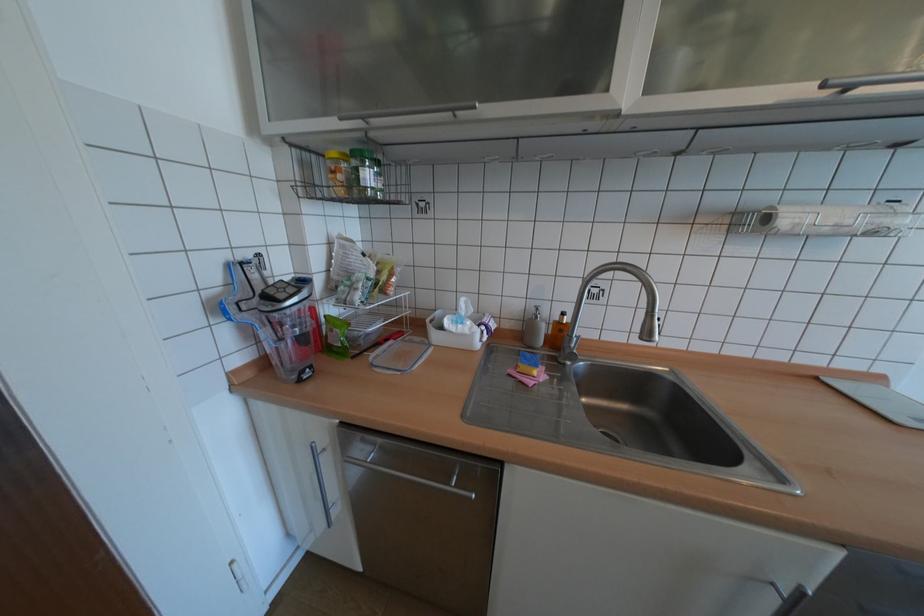
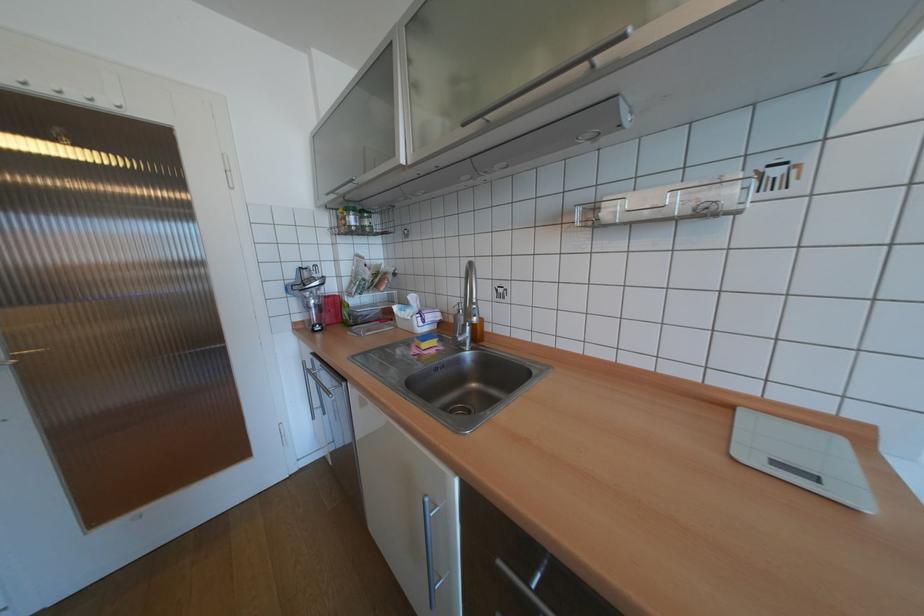
Question: The images are taken continuously from a first-person perspective. In which direction is your viewpoint rotating?

Choices:
 (A) Left
 (B) Right
 (C) Up
 (D) Down

Answer: (A)